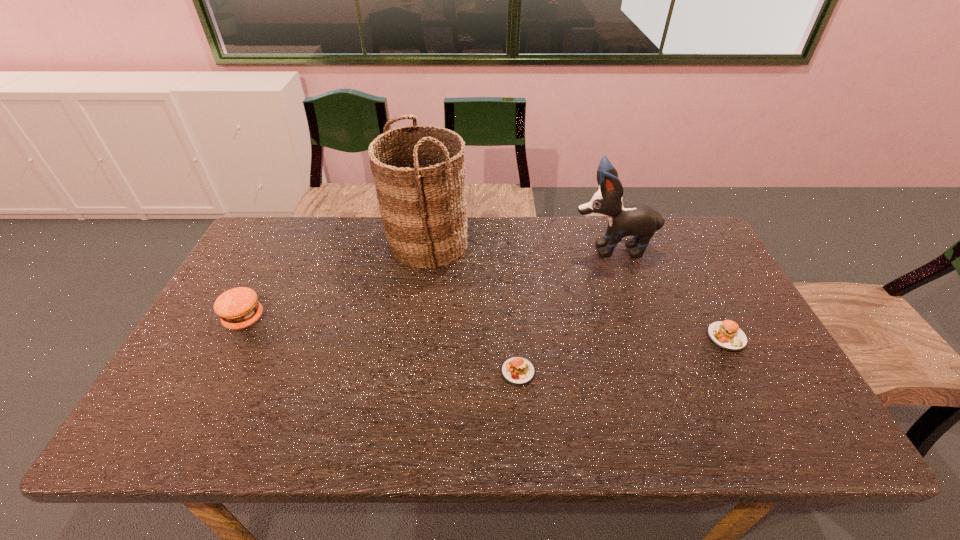
You are a GUI agent. You are given a task and a screenshot of the screen. Output one action in this format:
    pyautogui.click(x=<x>, y=<y>)
    Task: Click on the empty location between the fourth object from right to left and the nearest patty (food)
    This screenshot has width=960, height=540.
    Given the screenshot: What is the action you would take?
    pyautogui.click(x=472, y=307)

Where is `free space that is in between the rightmost patty (food) and the nearest patty (food)`? free space that is in between the rightmost patty (food) and the nearest patty (food) is located at coordinates (622, 354).

This screenshot has height=540, width=960. Find the location of `free space between the second tallest patty (food) and the leftmost patty (food)`. free space between the second tallest patty (food) and the leftmost patty (food) is located at coordinates (486, 328).

Locate an element on the screen. free point between the second patty (food) from left to right and the tallest object is located at coordinates (472, 307).

The image size is (960, 540). Identify the location of vacant space that's between the tallest patty (food) and the second patty (food) from right to left. (381, 345).

Image resolution: width=960 pixels, height=540 pixels. Identify the location of object that is the closest one to the basket. (238, 308).

Find the location of a particular element. The image size is (960, 540). object that ranks as the second closest to the fourth shortest object is located at coordinates (422, 206).

Where is `patty (food) that stands as the closest to the second shortest patty (food)`? This screenshot has width=960, height=540. patty (food) that stands as the closest to the second shortest patty (food) is located at coordinates pyautogui.click(x=519, y=371).

Locate an element on the screen. Image resolution: width=960 pixels, height=540 pixels. patty (food) that is the closest to the nearest patty (food) is located at coordinates (726, 334).

The width and height of the screenshot is (960, 540). In order to click on blank space that satisfies the following two spatial constraints: 1. on the back side of the third tallest object; 2. on the left side of the basket in this screenshot , I will do `click(283, 244)`.